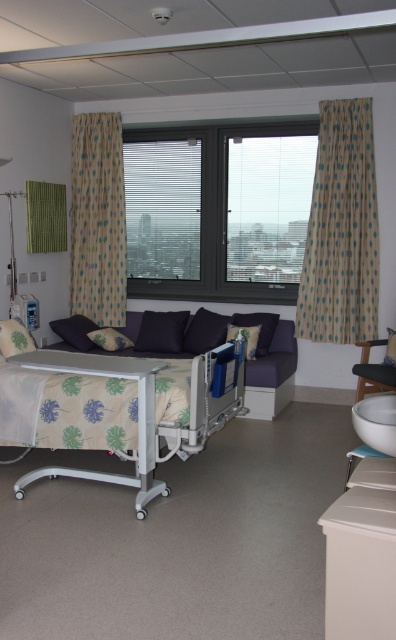
Question: Is patterned fabric bed at center positioned before blue fabric pillow at center?

Choices:
 (A) yes
 (B) no

Answer: (A)

Question: From the image, what is the correct spatial relationship of dark fabric pillow at center in relation to dark purple cushion at center left?

Choices:
 (A) left
 (B) right

Answer: (B)

Question: Based on their relative distances, which object is farther from the beige dotted fabric curtain at right?

Choices:
 (A) velvet purple pillow at center
 (B) dark gray plastic window at center
 (C) fluffy white pillow at left

Answer: (C)

Question: Is the position of dark fabric pillow at center less distant than that of blue fabric pillow at center?

Choices:
 (A) no
 (B) yes

Answer: (B)

Question: Which point is closer to the camera?

Choices:
 (A) dark gray plastic window at center
 (B) patterned fabric bed at center

Answer: (B)

Question: Which point is farther to the camera?

Choices:
 (A) beige dotted fabric curtain at right
 (B) polka dot fabric curtain at left

Answer: (B)